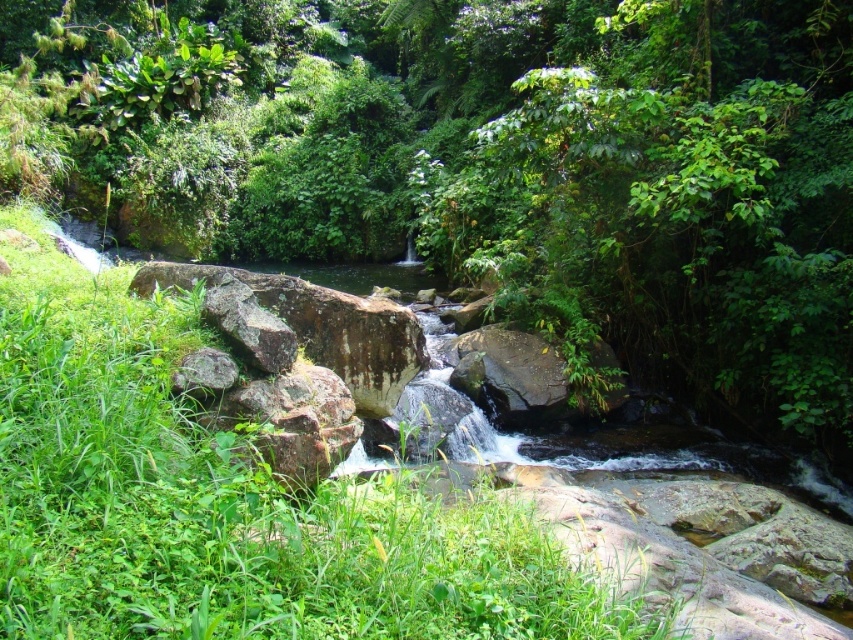
Is green leafy tree at center positioned behind green grass at lower left?

Yes, green leafy tree at center is behind green grass at lower left.

Is green leafy tree at center positioned in front of green grass at lower left?

No, green leafy tree at center is behind green grass at lower left.

Which is in front, point (556, 100) or point (91, 612)?

Point (91, 612)

Where is `green leafy tree at center`? Image resolution: width=853 pixels, height=640 pixels. green leafy tree at center is located at coordinates (486, 161).